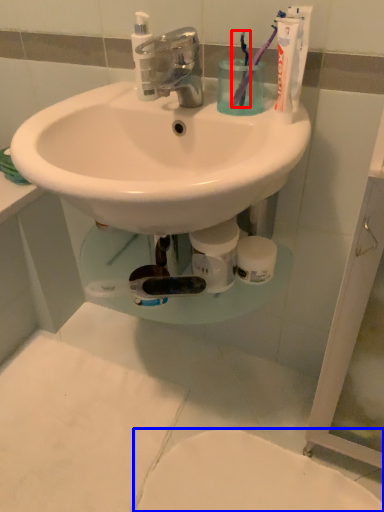
Question: Which of the following is the farthest to the observer, toothbrush (highlighted by a red box) or toilet (highlighted by a blue box)?

Choices:
 (A) toothbrush
 (B) toilet

Answer: (B)